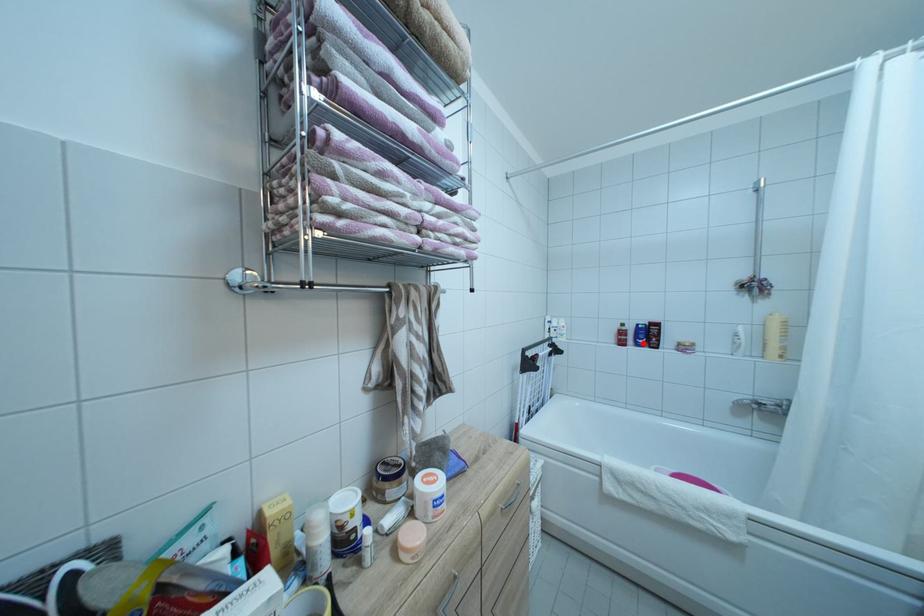
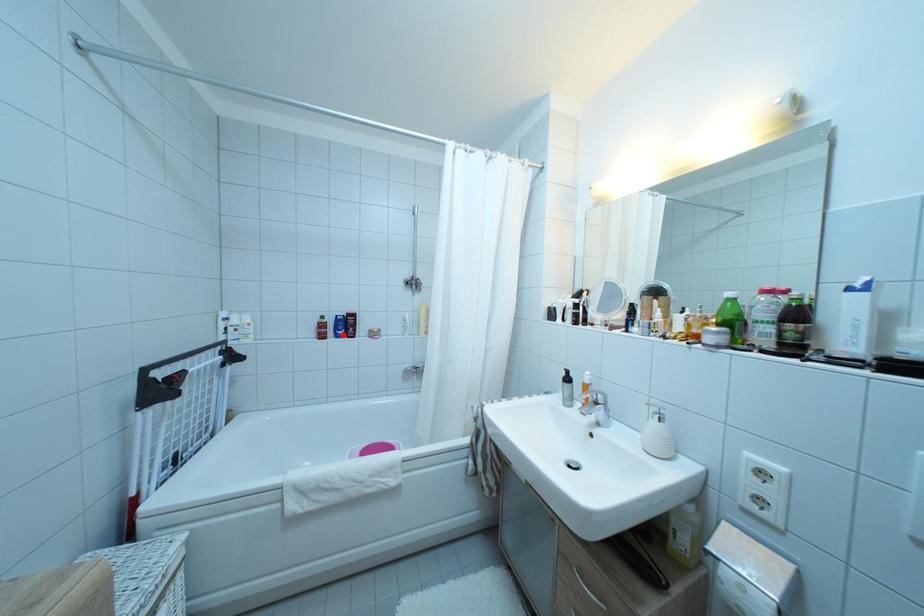
I am providing you with two images of the same scene from different viewpoints. A red point is marked on the first image and another point is marked on the second image. Are the points marked in image1 and image2 representing the same 3D position?

Yes